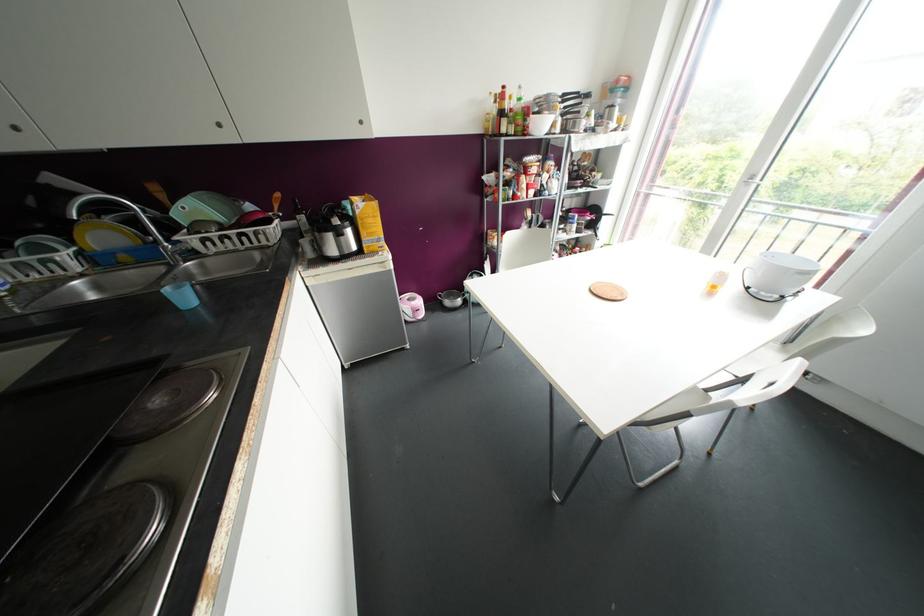
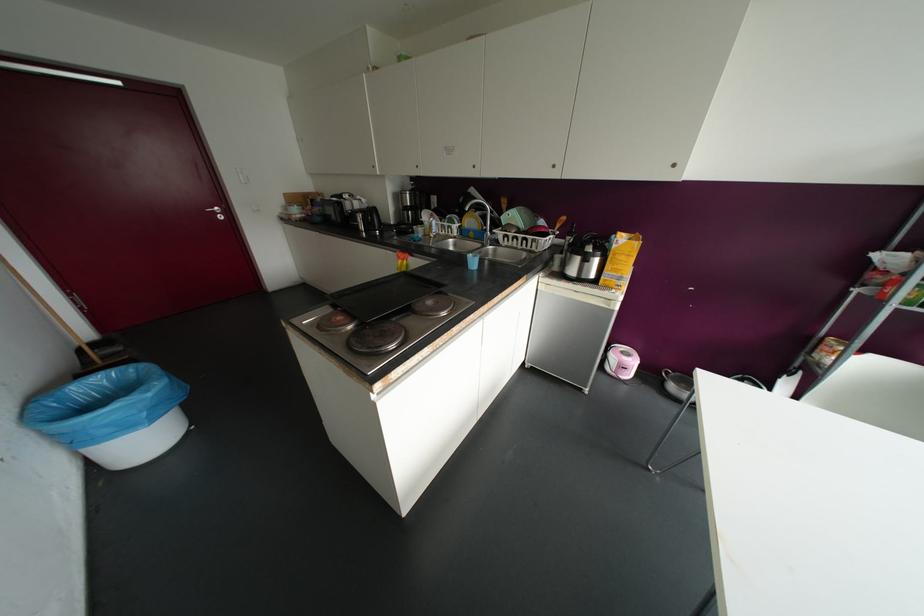
Find the pixel in the second image that matches pixel 332 216 in the first image.

(589, 244)